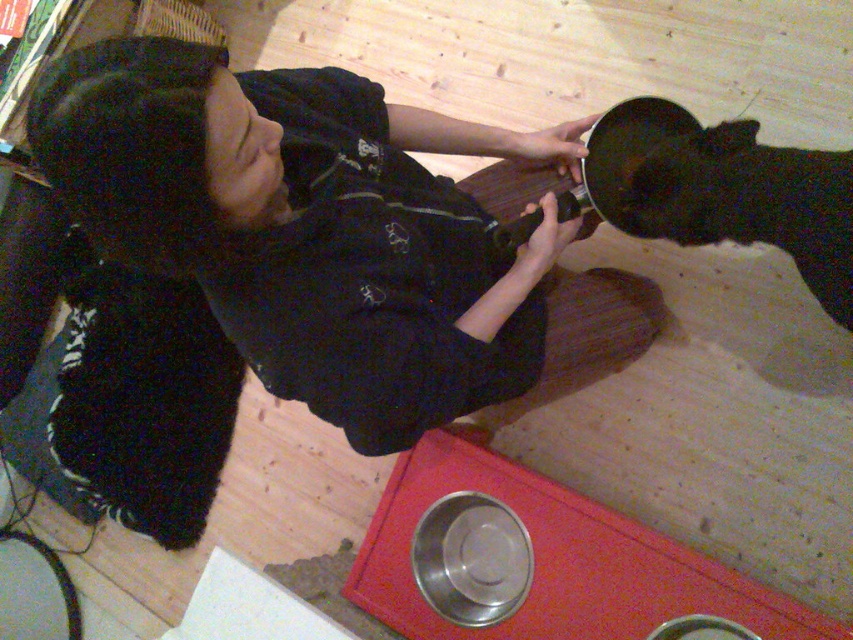
Question: Does black cotton shirt at upper center have a larger size compared to black fur pet at lower right?

Choices:
 (A) yes
 (B) no

Answer: (A)

Question: From the image, what is the correct spatial relationship of black cotton shirt at upper center in relation to black fur pet at lower right?

Choices:
 (A) left
 (B) right

Answer: (A)

Question: Which point is farther to the camera?

Choices:
 (A) click(x=167, y=38)
 (B) click(x=627, y=161)

Answer: (B)

Question: Does black cotton shirt at upper center come in front of black fur pet at lower right?

Choices:
 (A) no
 (B) yes

Answer: (B)

Question: Which point appears farthest from the camera in this image?

Choices:
 (A) (672, 193)
 (B) (297, 221)

Answer: (A)